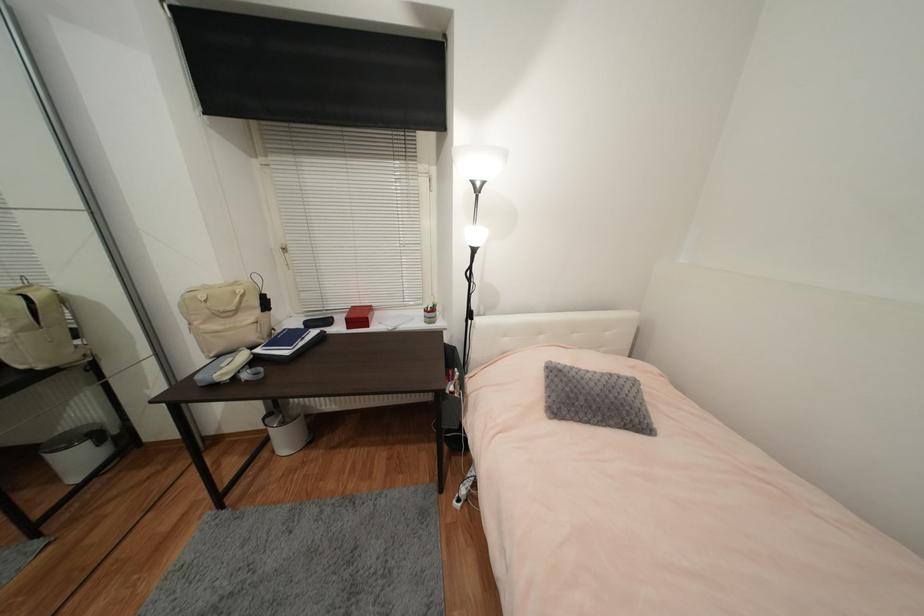
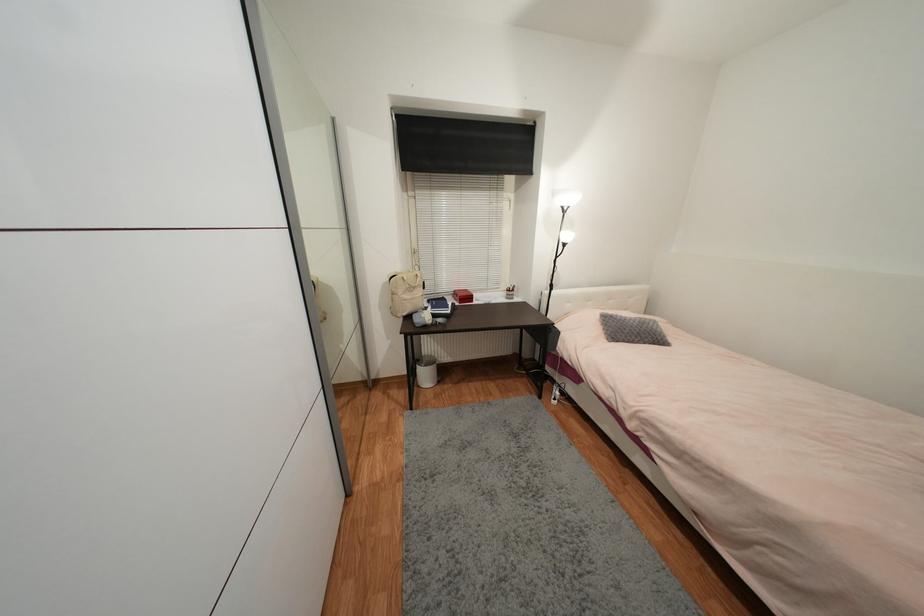
In the second image, find the point that corresponds to point (602, 391) in the first image.

(639, 326)